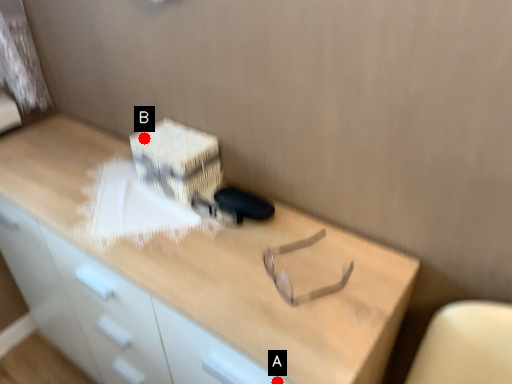
Question: Two points are circled on the image, labeled by A and B beside each circle. Which of the following is the farthest from the observer?

Choices:
 (A) A is further
 (B) B is further

Answer: (B)